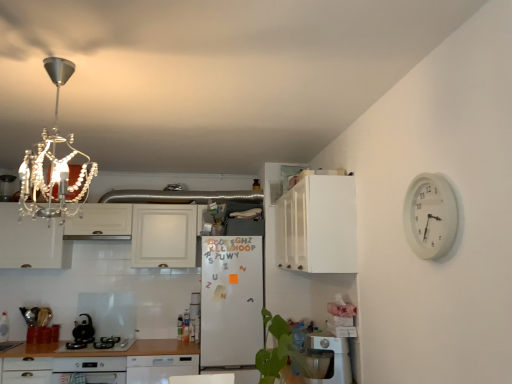
Identify the location of white glossy cabinet at upper left, arranged as the second cabinetry when viewed from the front. The height and width of the screenshot is (384, 512). (102, 234).

Image resolution: width=512 pixels, height=384 pixels. Find the location of `white plastic clock at upper right`. white plastic clock at upper right is located at coordinates (430, 216).

Locate an element on the screen. white matte cabinet at upper center, arranged as the second cabinetry when viewed from the left is located at coordinates (318, 225).

Where is `white matte refrigerator at center`? The width and height of the screenshot is (512, 384). white matte refrigerator at center is located at coordinates (231, 301).

Identify the location of clock in front of the white matte refrigerator at center. tap(430, 216).

Looking at this image, is white matte refrigerator at center smaller than white plastic clock at upper right?

No.

Between white matte refrigerator at center and white plastic clock at upper right, which one has larger width?

With larger width is white matte refrigerator at center.

From the image's perspective, would you say white matte refrigerator at center is shown under white plastic clock at upper right?

Yes, from the image's perspective, white matte refrigerator at center is below white plastic clock at upper right.

From the image's perspective, who appears lower, white matte cabinet at upper center, arranged as the second cabinetry when viewed from the left, or white glossy cabinet at upper left, marked as the second cabinetry in a right-to-left arrangement?

white glossy cabinet at upper left, marked as the second cabinetry in a right-to-left arrangement.

Between point (312, 190) and point (59, 226), which one is positioned behind?

Positioned behind is point (59, 226).

From a real-world perspective, is white matte cabinet at upper center, arranged as the second cabinetry when viewed from the left, above or below white glossy cabinet at upper left, which is counted as the first cabinetry, starting from the back?

From a real-world perspective, white matte cabinet at upper center, arranged as the second cabinetry when viewed from the left, is physically above white glossy cabinet at upper left, which is counted as the first cabinetry, starting from the back.

Is white plastic dish washer at lower center, the 2th dish washer positioned from the bottom, touching white plastic clock at upper right?

No.

Considering the sizes of objects white plastic dish washer at lower center, positioned as the second dish washer in back-to-front order, and white plastic clock at upper right in the image provided, who is taller, white plastic dish washer at lower center, positioned as the second dish washer in back-to-front order, or white plastic clock at upper right?

Standing taller between the two is white plastic clock at upper right.

Is white plastic dish washer at lower center, the 2th dish washer from the left, aimed at white plastic clock at upper right?

No, white plastic dish washer at lower center, the 2th dish washer from the left, is not turned towards white plastic clock at upper right.

Looking at the image, does white plastic dish washer at lower center, which appears as the 1th dish washer when viewed from the front, seem bigger or smaller compared to white plastic clock at upper right?

Considering their sizes, white plastic dish washer at lower center, which appears as the 1th dish washer when viewed from the front, takes up more space than white plastic clock at upper right.

From their relative heights in the image, would you say white glossy dishwasher at lower center, placed as the first dish washer when sorted from back to front, is taller or shorter than white matte refrigerator at center?

Clearly, white glossy dishwasher at lower center, placed as the first dish washer when sorted from back to front, is shorter compared to white matte refrigerator at center.

Looking at this image, is white matte refrigerator at center inside white glossy dishwasher at lower center, the 2th dish washer from the top?

No, white glossy dishwasher at lower center, the 2th dish washer from the top, does not contain white matte refrigerator at center.

Is white glossy dishwasher at lower center, the 2th dish washer from the top, far away from white matte refrigerator at center?

white glossy dishwasher at lower center, the 2th dish washer from the top, is near white matte refrigerator at center, not far away.

Considering the relative sizes of white matte cabinet at upper center, arranged as the second cabinetry when viewed from the left, and white plastic clock at upper right in the image provided, is white matte cabinet at upper center, arranged as the second cabinetry when viewed from the left, thinner than white plastic clock at upper right?

No.

Is white matte cabinet at upper center, arranged as the second cabinetry when viewed from the left, further to the viewer compared to white plastic clock at upper right?

Yes, white matte cabinet at upper center, arranged as the second cabinetry when viewed from the left, is further from the viewer.

From a real-world perspective, is white matte cabinet at upper center, which is the first cabinetry in front-to-back order, positioned above or below white plastic clock at upper right?

white matte cabinet at upper center, which is the first cabinetry in front-to-back order, is above white plastic clock at upper right.

Is white matte cabinet at upper center, which ranks as the 2th cabinetry in back-to-front order, next to white plastic clock at upper right?

No, white matte cabinet at upper center, which ranks as the 2th cabinetry in back-to-front order, is not making contact with white plastic clock at upper right.

Does white plastic dish washer at lower center, arranged as the first dish washer when viewed from the top, appear on the right side of black glass cooktop at lower left?

Indeed, white plastic dish washer at lower center, arranged as the first dish washer when viewed from the top, is positioned on the right side of black glass cooktop at lower left.

Is white plastic dish washer at lower center, positioned as the second dish washer in back-to-front order, in contact with black glass cooktop at lower left?

No, white plastic dish washer at lower center, positioned as the second dish washer in back-to-front order, is not touching black glass cooktop at lower left.

Between white plastic clock at upper right and black glass cooktop at lower left, which one is positioned in front?

white plastic clock at upper right is more forward.

Visually, is white plastic clock at upper right positioned to the left or to the right of black glass cooktop at lower left?

From the image, it's evident that white plastic clock at upper right is to the right of black glass cooktop at lower left.

Does white plastic clock at upper right have a greater width compared to black glass cooktop at lower left?

In fact, white plastic clock at upper right might be narrower than black glass cooktop at lower left.

Is point (420, 216) positioned before point (109, 349)?

Yes, it is in front of point (109, 349).

Where is `clock located above the white matte refrigerator at center (from a real-world perspective)`? This screenshot has height=384, width=512. clock located above the white matte refrigerator at center (from a real-world perspective) is located at coordinates (430, 216).

Locate an element on the screen. The image size is (512, 384). cabinetry behind the white matte cabinet at upper center, which ranks as the 2th cabinetry in back-to-front order is located at coordinates (102, 234).

When comparing their distances from white plastic dish washer at lower center, the 2th dish washer from the left, does white glossy cabinet at upper left, which is counted as the first cabinetry, starting from the back, or black matte kettle at lower left seem closer?

white glossy cabinet at upper left, which is counted as the first cabinetry, starting from the back, is closer to white plastic dish washer at lower center, the 2th dish washer from the left.

From the image, which object appears to be farther from white plastic dish washer at lower center, the 2th dish washer from the left, white glossy cabinet at upper left, the 1th cabinetry from the left, or black glass cooktop at lower left?

Among the two, white glossy cabinet at upper left, the 1th cabinetry from the left, is located further to white plastic dish washer at lower center, the 2th dish washer from the left.

Considering their positions, is black glass cooktop at lower left positioned closer to white plastic clock at upper right than white matte cabinet at upper center, which ranks as the 2th cabinetry in back-to-front order?

Among the two, white matte cabinet at upper center, which ranks as the 2th cabinetry in back-to-front order, is located nearer to white plastic clock at upper right.

When comparing their distances from white matte cabinet at upper center, arranged as the second cabinetry when viewed from the left, does white plastic clock at upper right or white matte refrigerator at center seem closer?

white plastic clock at upper right.

From the image, which object appears to be nearer to white glossy cabinet at upper left, the 1th cabinetry from the left, white plastic clock at upper right or black glass cooktop at lower left?

The object closer to white glossy cabinet at upper left, the 1th cabinetry from the left, is black glass cooktop at lower left.

Which object lies nearer to the anchor point black matte kettle at lower left, white glossy dishwasher at lower center, the first dish washer when ordered from bottom to top, or white plastic dish washer at lower center, the 2th dish washer from the left?

Among the two, white glossy dishwasher at lower center, the first dish washer when ordered from bottom to top, is located nearer to black matte kettle at lower left.

Based on their spatial positions, is white matte cabinet at upper center, arranged as the second cabinetry when viewed from the left, or white glossy cabinet at upper left, arranged as the second cabinetry when viewed from the front, further from white plastic dish washer at lower center, the 2th dish washer positioned from the bottom?

white glossy cabinet at upper left, arranged as the second cabinetry when viewed from the front, lies further to white plastic dish washer at lower center, the 2th dish washer positioned from the bottom, than the other object.

Based on the photo, looking at the image, which one is located further to white matte refrigerator at center, white plastic dish washer at lower center, which appears as the 1th dish washer when viewed from the front, or white plastic clock at upper right?

white plastic clock at upper right lies further to white matte refrigerator at center than the other object.

The height and width of the screenshot is (384, 512). I want to click on kitchen appliance between black matte kettle at lower left and white plastic dish washer at lower center, which is the first dish washer from right to left, so click(x=122, y=345).

I want to click on dish washer situated between black glass cooktop at lower left and white matte refrigerator at center from left to right, so coord(160,368).

Locate an element on the screen. The image size is (512, 384). cabinetry between white plastic clock at upper right and white matte refrigerator at center along the z-axis is located at coordinates (318, 225).

Where is `fridge situated between black matte kettle at lower left and white matte cabinet at upper center, arranged as the second cabinetry when viewed from the left, from left to right`? The width and height of the screenshot is (512, 384). fridge situated between black matte kettle at lower left and white matte cabinet at upper center, arranged as the second cabinetry when viewed from the left, from left to right is located at coordinates (231, 301).